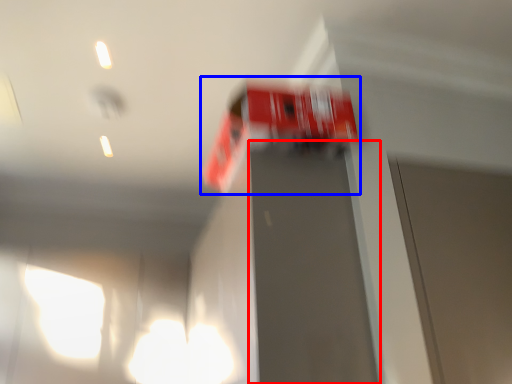
Question: Which object is closer to the camera taking this photo, elevator door (highlighted by a red box) or vehicle (highlighted by a blue box)?

Choices:
 (A) elevator door
 (B) vehicle

Answer: (A)